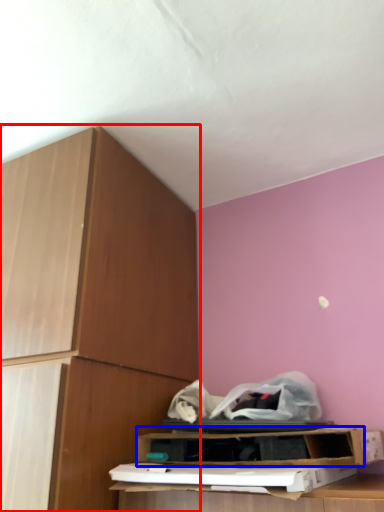
Question: Which of the following is the farthest to the observer, cabinetry (highlighted by a red box) or shelf (highlighted by a blue box)?

Choices:
 (A) cabinetry
 (B) shelf

Answer: (B)